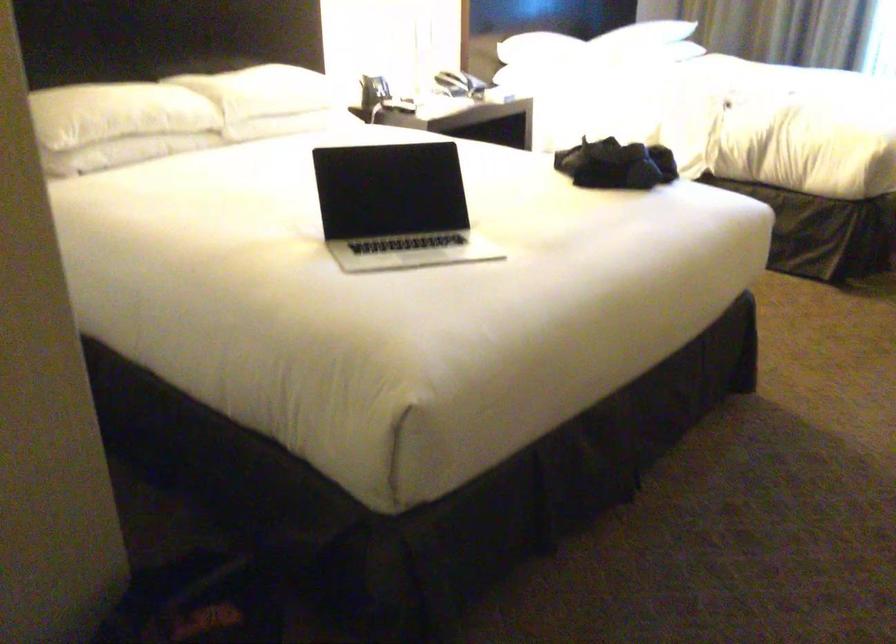
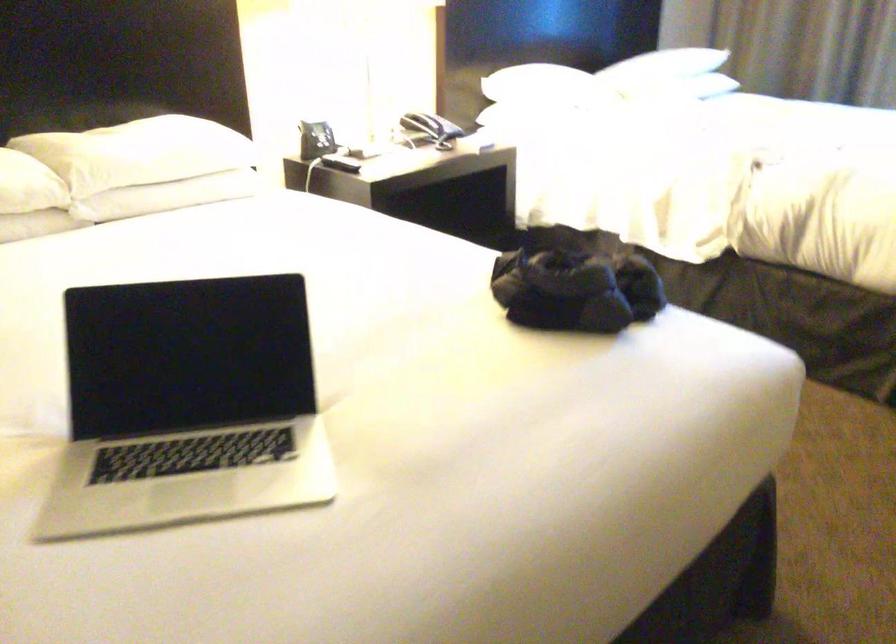
In the second image, find the point that corresponds to point (297, 77) in the first image.

(186, 136)